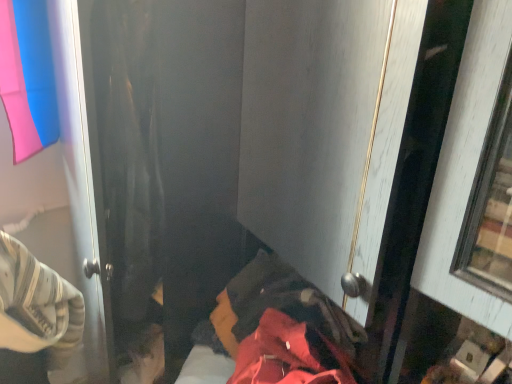
The width and height of the screenshot is (512, 384). What do you see at coordinates (274, 332) in the screenshot? I see `red fabric bed at lower center` at bounding box center [274, 332].

What is the approximate width of red fabric bed at lower center?

The width of red fabric bed at lower center is 14.15 inches.

This screenshot has width=512, height=384. In order to click on red fabric bed at lower center in this screenshot , I will do `click(274, 332)`.

The height and width of the screenshot is (384, 512). Identify the location of pink fabric at upper left. tap(64, 187).

The image size is (512, 384). What do you see at coordinates (64, 187) in the screenshot?
I see `pink fabric at upper left` at bounding box center [64, 187].

You are a GUI agent. You are given a task and a screenshot of the screen. Output one action in this format:
    pyautogui.click(x=<x>, y=<y>)
    Task: Click on the red fabric bed at lower center
    
    Given the screenshot: What is the action you would take?
    pyautogui.click(x=274, y=332)

Which is more to the left, pink fabric at upper left or red fabric bed at lower center?

pink fabric at upper left is more to the left.

Between pink fabric at upper left and red fabric bed at lower center, which one is positioned in front?

red fabric bed at lower center is more forward.

Does point (67, 80) come closer to viewer compared to point (229, 295)?

Yes.

From the image's perspective, is pink fabric at upper left on red fabric bed at lower center?

Yes.

Consider the image. From a real-world perspective, who is located lower, pink fabric at upper left or red fabric bed at lower center?

In real-world perspective, red fabric bed at lower center is lower.

Does pink fabric at upper left have a lesser width compared to red fabric bed at lower center?

Yes.

Is pink fabric at upper left shorter than red fabric bed at lower center?

No.

Considering the sizes of objects pink fabric at upper left and red fabric bed at lower center in the image provided, who is smaller, pink fabric at upper left or red fabric bed at lower center?

Smaller between the two is pink fabric at upper left.

Is pink fabric at upper left completely or partially outside of red fabric bed at lower center?

pink fabric at upper left lies outside red fabric bed at lower center's area.

Is pink fabric at upper left with red fabric bed at lower center?

pink fabric at upper left and red fabric bed at lower center are clearly separated.

Is red fabric bed at lower center at the back of pink fabric at upper left?

pink fabric at upper left is not turned away from red fabric bed at lower center.

Measure the distance from pink fabric at upper left to red fabric bed at lower center.

They are 17.06 inches apart.

Where is `bed that is in front of the pink fabric at upper left`? This screenshot has height=384, width=512. bed that is in front of the pink fabric at upper left is located at coordinates (274, 332).

Consider the image. Between red fabric bed at lower center and pink fabric at upper left, which one appears on the left side from the viewer's perspective?

pink fabric at upper left is more to the left.

Considering the positions of objects red fabric bed at lower center and pink fabric at upper left in the image provided, who is in front, red fabric bed at lower center or pink fabric at upper left?

red fabric bed at lower center is more forward.

Does point (265, 350) come behind point (9, 199)?

No, (265, 350) is in front of (9, 199).

From the image's perspective, which object appears higher, red fabric bed at lower center or pink fabric at upper left?

From the image's view, pink fabric at upper left is above.

From a real-world perspective, does red fabric bed at lower center sit lower than pink fabric at upper left?

Indeed, from a real-world perspective, red fabric bed at lower center is positioned beneath pink fabric at upper left.

Is red fabric bed at lower center thinner than pink fabric at upper left?

In fact, red fabric bed at lower center might be wider than pink fabric at upper left.

Is red fabric bed at lower center taller than pink fabric at upper left?

No.

Between red fabric bed at lower center and pink fabric at upper left, which one has smaller size?

pink fabric at upper left.

Is pink fabric at upper left a part of red fabric bed at lower center?

No, red fabric bed at lower center does not contain pink fabric at upper left.

Is there a large distance between red fabric bed at lower center and pink fabric at upper left?

No, red fabric bed at lower center is in close proximity to pink fabric at upper left.

Is red fabric bed at lower center oriented away from pink fabric at upper left?

red fabric bed at lower center is not turned away from pink fabric at upper left.

This screenshot has width=512, height=384. I want to click on bed located on the right of pink fabric at upper left, so click(x=274, y=332).

Where is `bed in front of the pink fabric at upper left`? This screenshot has height=384, width=512. bed in front of the pink fabric at upper left is located at coordinates (274, 332).

The image size is (512, 384). Find the location of `bed below the pink fabric at upper left (from the image's perspective)`. bed below the pink fabric at upper left (from the image's perspective) is located at coordinates (274, 332).